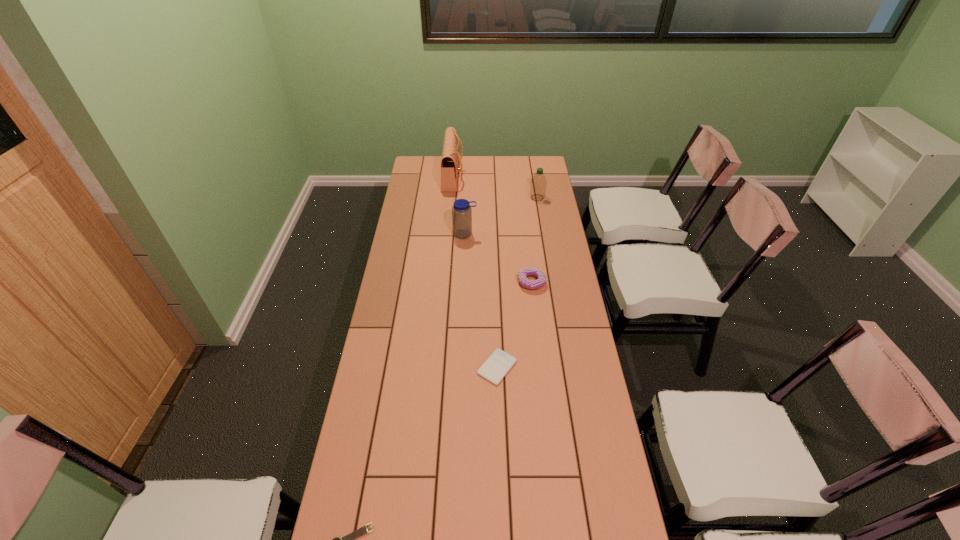
Find the location of a particular element. The image size is (960, 540). the tallest object is located at coordinates tap(450, 159).

Locate an element on the screen. This screenshot has height=540, width=960. the farthest object is located at coordinates (450, 159).

This screenshot has width=960, height=540. What are the coordinates of `the left water bottle` in the screenshot? It's located at (461, 211).

This screenshot has height=540, width=960. I want to click on the nearer water bottle, so click(x=461, y=211).

I want to click on the right water bottle, so click(x=538, y=183).

At what (x,y) coordinates should I click in order to perform the action: click on the fifth nearest object. Please return your answer as a coordinate pair (x, y). Image resolution: width=960 pixels, height=540 pixels. Looking at the image, I should click on (538, 183).

Locate an element on the screen. doughnut is located at coordinates (529, 271).

Image resolution: width=960 pixels, height=540 pixels. What are the coordinates of `the fourth tallest object` in the screenshot? It's located at (529, 271).

The image size is (960, 540). I want to click on the third object from right to left, so click(x=499, y=363).

I want to click on calculator, so click(499, 363).